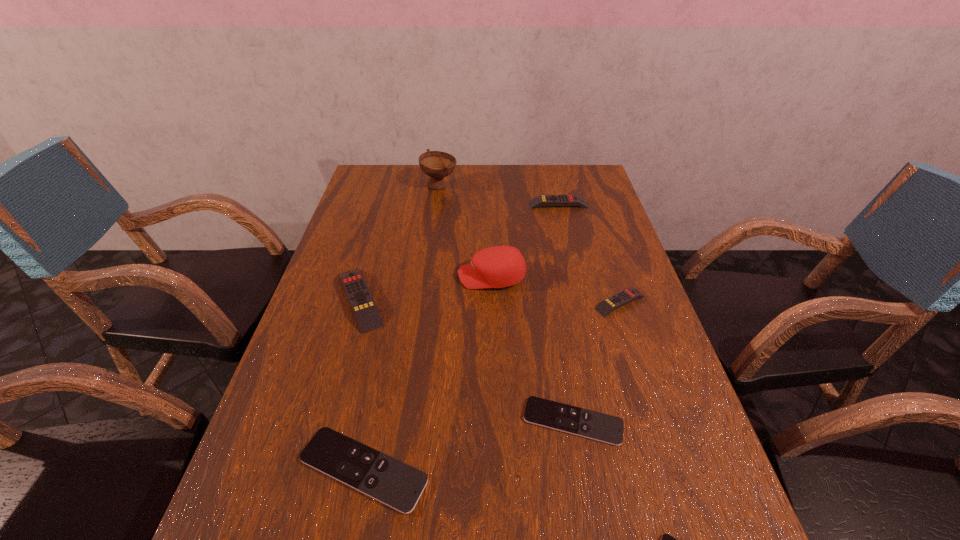
You are a GUI agent. You are given a task and a screenshot of the screen. Output one action in this format:
    pyautogui.click(x=<x>, y=<y>)
    Task: Click on the free space between the third shortest object and the red cap
    This screenshot has height=540, width=960.
    Given the screenshot: What is the action you would take?
    pyautogui.click(x=427, y=373)

Image resolution: width=960 pixels, height=540 pixels. I want to click on free space between the farthest object and the second shortest object, so click(x=506, y=303).

You are a GUI agent. You are given a task and a screenshot of the screen. Output one action in this format:
    pyautogui.click(x=<x>, y=<y>)
    Task: Click on the free space between the biggest yellow remote control and the farthest yellow remote control
    
    Given the screenshot: What is the action you would take?
    pyautogui.click(x=459, y=252)

At what (x,y) coordinates should I click in order to perform the action: click on empty space that is in between the tallest remote control and the soup bowl. Please return your answer as a coordinate pair (x, y). This screenshot has height=540, width=960. Looking at the image, I should click on (399, 242).

At what (x,y) coordinates should I click in order to perform the action: click on vacant area that lies between the third tallest remote control and the cap. Please return your answer as a coordinate pair (x, y). The width and height of the screenshot is (960, 540). Looking at the image, I should click on (556, 290).

The image size is (960, 540). Find the location of `the fourth closest object to the smallest yellow remote control`. the fourth closest object to the smallest yellow remote control is located at coordinates (398, 485).

At what (x,y) coordinates should I click in order to perform the action: click on the seventh closest object relative to the leftmost yellow remote control. Please return your answer as a coordinate pair (x, y). This screenshot has height=540, width=960. Looking at the image, I should click on (666, 539).

Identify which remote control is the third nearest to the smallest yellow remote control. Please provide its 2D coordinates. Your answer should be formatted as a tuple, i.e. [(x, y)], where the tuple contains the x and y coordinates of a point satisfying the conditions above.

[(398, 485)]

Locate an element on the screen. This screenshot has width=960, height=540. remote control that stands as the third closest to the seventh nearest object is located at coordinates (605, 428).

Find the location of a particular element. yellow remote control that stands as the second closest to the tallest remote control is located at coordinates (622, 298).